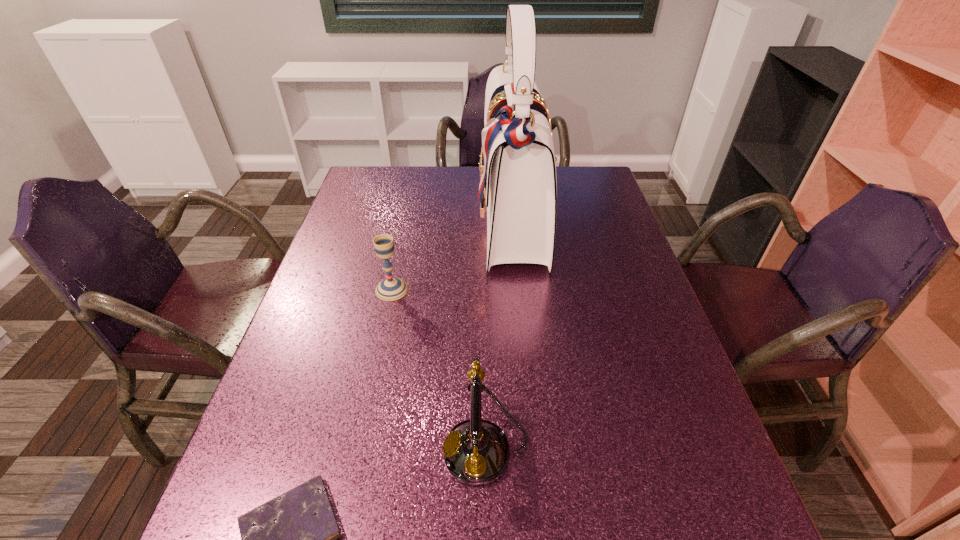
You are a GUI agent. You are given a task and a screenshot of the screen. Output one action in this format:
    pyautogui.click(x=<x>, y=<y>)
    Task: Click on the tallest object
    The image size is (960, 540).
    Given the screenshot: What is the action you would take?
    pyautogui.click(x=517, y=166)

Where is `chalice`? The image size is (960, 540). chalice is located at coordinates (392, 288).

The width and height of the screenshot is (960, 540). Identify the location of telephone. (476, 452).

Find the location of a particular element. free point located 0.400m on the front-facing side of the satchel is located at coordinates (348, 220).

Identify the location of blank area located 0.080m on the front-facing side of the satchel. (453, 220).

Image resolution: width=960 pixels, height=540 pixels. Find the location of `free space located 0.330m on the front-facing side of the satchel`. free space located 0.330m on the front-facing side of the satchel is located at coordinates (372, 220).

Find the location of a particular element. The height and width of the screenshot is (540, 960). free spot located 0.050m on the left of the chalice is located at coordinates (356, 289).

At what (x,y) coordinates should I click in order to perform the action: click on vacant space located on the dial of the telephone. Please return your answer as a coordinate pair (x, y). Looking at the image, I should click on (270, 449).

The height and width of the screenshot is (540, 960). Find the location of `free spot located 0.350m on the dial of the telephone`. free spot located 0.350m on the dial of the telephone is located at coordinates (253, 449).

You are a GUI agent. You are given a task and a screenshot of the screen. Output one action in this format:
    pyautogui.click(x=<x>, y=<y>)
    Task: Click on the blank space located 0.370m on the dial of the telephone
    
    Given the screenshot: What is the action you would take?
    pyautogui.click(x=242, y=449)